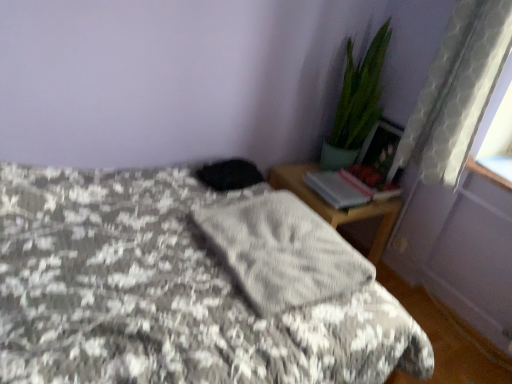
Where is `blank space situated above wooden nightstand at right (from a real-world perspective)`? blank space situated above wooden nightstand at right (from a real-world perspective) is located at coordinates (332, 186).